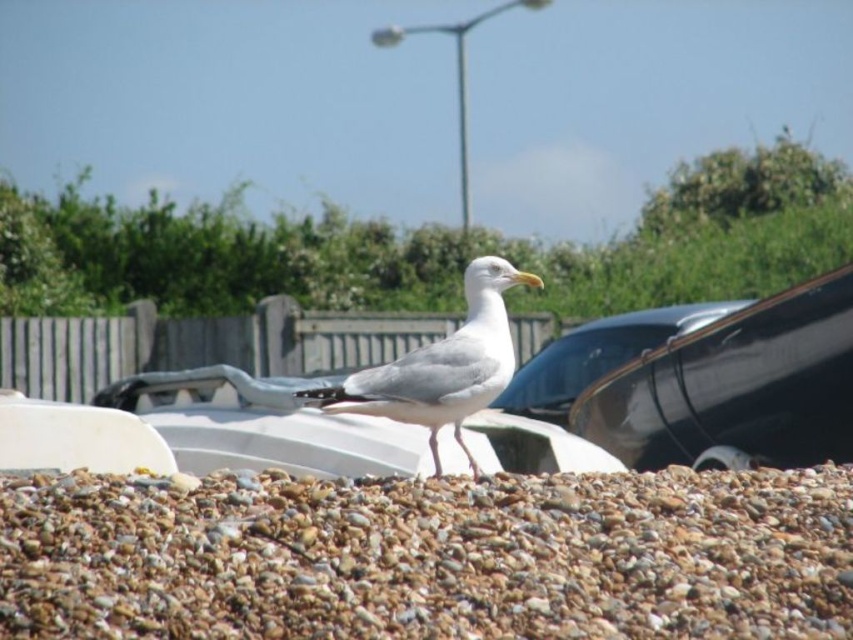
You are a photographer trying to capture the white matte seagull at center. However, you notice that the brown pebbles at center might block your view. Based on their positions, can you see the seagull clearly through the pebbles?

The brown pebbles at center are in front of the white matte seagull at center, so they would block the view of the seagull, making it difficult to see clearly.

You are a photographer trying to capture the seagull and the boats in the background. You notice two points marked in the image at coordinates point (778, 509) and point (616, 332). Which of these points is closer to the camera, and how does this affect your composition?

Point (778, 509) is closer to the camera than point (616, 332). This means that when composing your photo, the area around point (778, 509) will appear more prominent and in focus compared to the other point, which is farther back.

You are a photographer trying to capture a shot of the brown pebbles at center and the glossy black car at center. Your camera has a maximum focus range of 8 meters. Can you capture both objects in focus without moving your position?

The brown pebbles at center and glossy black car at center are 7.94 meters apart from each other. Since the distance between them is within the camera maximum focus range of 8 meters, you can capture both objects in focus without moving your position.